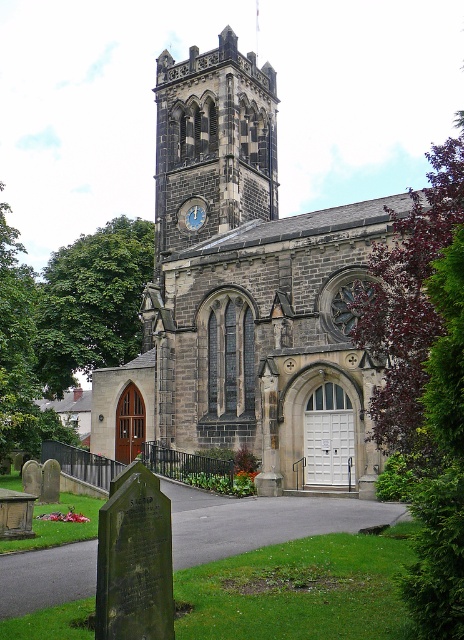
Question: Considering the real-world distances, which object is closest to the dark gray stone church at center?

Choices:
 (A) blue stone clock at upper center
 (B) dark gray stone clock tower at upper center

Answer: (B)

Question: Which is farther from the blue stone clock at upper center?

Choices:
 (A) dark gray stone clock tower at upper center
 (B) dark gray stone church at center

Answer: (B)

Question: In this image, where is dark gray stone church at center located relative to blue stone clock at upper center?

Choices:
 (A) above
 (B) below

Answer: (B)

Question: Which object appears closest to the camera in this image?

Choices:
 (A) dark gray stone clock tower at upper center
 (B) dark gray stone church at center
 (C) blue stone clock at upper center

Answer: (B)

Question: Where is dark gray stone clock tower at upper center located in relation to blue stone clock at upper center in the image?

Choices:
 (A) above
 (B) below

Answer: (A)

Question: Where is dark gray stone church at center located in relation to blue stone clock at upper center in the image?

Choices:
 (A) left
 (B) right

Answer: (B)